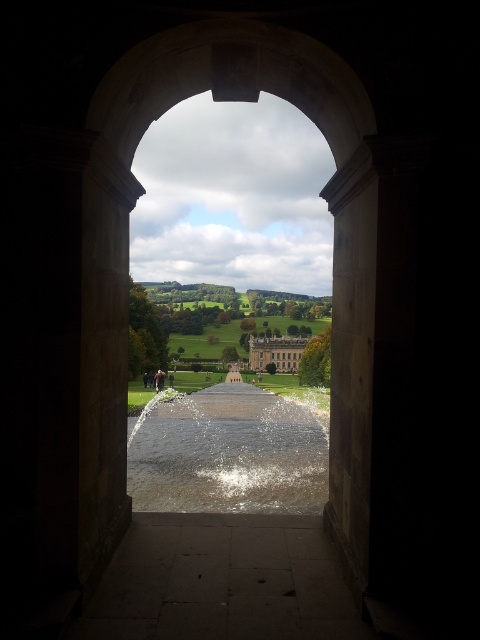
Does clear water at center appear on the left side of stone gray palace at center?

Correct, you'll find clear water at center to the left of stone gray palace at center.

Which is in front, point (243, 428) or point (300, 339)?

Positioned in front is point (243, 428).

Identify the location of clear water at center. (228, 452).

The height and width of the screenshot is (640, 480). Describe the element at coordinates (222, 580) in the screenshot. I see `dark stone path at center` at that location.

Between dark stone path at center and stone gray palace at center, which one is positioned lower?

Positioned lower is stone gray palace at center.

Looking at this image, who is more distant from viewer, (144, 632) or (288, 358)?

Positioned behind is point (288, 358).

The width and height of the screenshot is (480, 640). In order to click on dark stone path at center in this screenshot , I will do `click(222, 580)`.

Does point (177, 579) lie in front of point (271, 406)?

Yes.

Which is behind, point (204, 618) or point (296, 465)?

Positioned behind is point (296, 465).

Does point (241, 612) lie in front of point (199, 456)?

Yes, it is in front of point (199, 456).

At what (x,y) coordinates should I click in order to perform the action: click on dark stone path at center. Please return your answer as a coordinate pair (x, y). The height and width of the screenshot is (640, 480). Looking at the image, I should click on (222, 580).